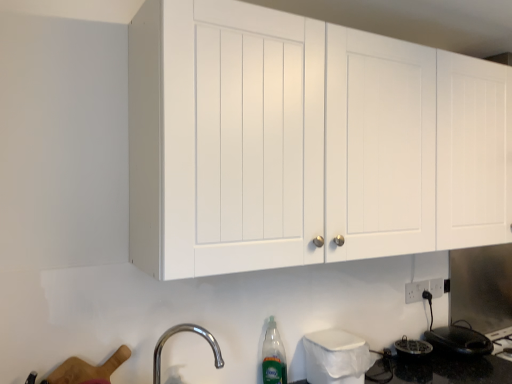
Find the location of a particular element. white plastic trash can at lower center, arranged as the second appliance when viewed from the right is located at coordinates (335, 357).

What do you see at coordinates (335, 357) in the screenshot? I see `white plastic trash can at lower center, placed as the 1th appliance when sorted from front to back` at bounding box center [335, 357].

Locate an element on the screen. translucent plastic bottle at lower center is located at coordinates (273, 356).

Locate an element on the screen. black glossy electric kettle at lower right, which appears as the first appliance when viewed from the right is located at coordinates (459, 340).

The height and width of the screenshot is (384, 512). What do you see at coordinates (184, 331) in the screenshot?
I see `chrome metallic faucet at lower left` at bounding box center [184, 331].

This screenshot has height=384, width=512. Identify the location of white plastic trash can at lower center, which is the 1th appliance in left-to-right order. (335, 357).

Looking at this image, does translucent plastic bottle at lower center come in front of chrome metallic faucet at lower left?

No, it is behind chrome metallic faucet at lower left.

Does translucent plastic bottle at lower center have a greater width compared to chrome metallic faucet at lower left?

In fact, translucent plastic bottle at lower center might be narrower than chrome metallic faucet at lower left.

Can you tell me how much translucent plastic bottle at lower center and chrome metallic faucet at lower left differ in facing direction?

They differ by 0.00493 degrees in their facing directions.

Is point (281, 345) farther from camera compared to point (222, 358)?

Yes, it is.

From a real-world perspective, is white matte cabinet at upper center beneath chrome metallic faucet at lower left?

No.

Where is `tap on the left of white matte cabinet at upper center`? This screenshot has height=384, width=512. tap on the left of white matte cabinet at upper center is located at coordinates (184, 331).

Could you tell me if white matte cabinet at upper center is facing chrome metallic faucet at lower left?

No, white matte cabinet at upper center is not turned towards chrome metallic faucet at lower left.

Is white matte cabinet at upper center not near chrome metallic faucet at lower left?

No, white matte cabinet at upper center is in close proximity to chrome metallic faucet at lower left.

From a real-world perspective, is translucent plastic bottle at lower center on top of white matte cabinet at upper center?

No, from a real-world perspective, translucent plastic bottle at lower center is not over white matte cabinet at upper center

In the scene shown: Can you confirm if translucent plastic bottle at lower center is wider than white matte cabinet at upper center?

In fact, translucent plastic bottle at lower center might be narrower than white matte cabinet at upper center.

Is translucent plastic bottle at lower center looking in the opposite direction of white matte cabinet at upper center?

translucent plastic bottle at lower center is not turned away from white matte cabinet at upper center.

Is white plastic trash can at lower center, placed as the 1th appliance when sorted from front to back, aimed at white matte cabinet at upper center?

No.

Is the position of white plastic trash can at lower center, the second appliance viewed from the back, more distant than that of white matte cabinet at upper center?

Yes, white plastic trash can at lower center, the second appliance viewed from the back, is further from the camera.

How many degrees apart are the facing directions of white plastic trash can at lower center, placed as the 1th appliance when sorted from front to back, and white matte cabinet at upper center?

0.00213 degrees.

Is the surface of white plastic trash can at lower center, arranged as the second appliance when viewed from the right, in direct contact with white matte cabinet at upper center?

No, white plastic trash can at lower center, arranged as the second appliance when viewed from the right, is not making contact with white matte cabinet at upper center.

Considering the sizes of black glossy electric kettle at lower right, arranged as the 2th appliance when viewed from the front, and translucent plastic bottle at lower center in the image, is black glossy electric kettle at lower right, arranged as the 2th appliance when viewed from the front, bigger or smaller than translucent plastic bottle at lower center?

black glossy electric kettle at lower right, arranged as the 2th appliance when viewed from the front, is bigger than translucent plastic bottle at lower center.

Is black glossy electric kettle at lower right, which ranks as the second appliance in left-to-right order, in front of or behind translucent plastic bottle at lower center in the image?

black glossy electric kettle at lower right, which ranks as the second appliance in left-to-right order, is behind translucent plastic bottle at lower center.

Is point (472, 354) closer or farther from the camera than point (270, 350)?

Point (472, 354).

Looking at their sizes, would you say white matte cabinet at upper center is wider or thinner than black glossy electric kettle at lower right, arranged as the 2th appliance when viewed from the front?

Clearly, white matte cabinet at upper center has more width compared to black glossy electric kettle at lower right, arranged as the 2th appliance when viewed from the front.

Locate an element on the screen. The image size is (512, 384). cabinetry above the black glossy electric kettle at lower right, which ranks as the first appliance in back-to-front order (from a real-world perspective) is located at coordinates (303, 141).

Between white matte cabinet at upper center and black glossy electric kettle at lower right, which ranks as the first appliance in back-to-front order, which one has smaller size?

With smaller size is black glossy electric kettle at lower right, which ranks as the first appliance in back-to-front order.

Is white plastic trash can at lower center, placed as the 1th appliance when sorted from front to back, oriented away from black glossy electric kettle at lower right, arranged as the 2th appliance when viewed from the front?

No, white plastic trash can at lower center, placed as the 1th appliance when sorted from front to back, is not facing away from black glossy electric kettle at lower right, arranged as the 2th appliance when viewed from the front.

Can you confirm if white plastic trash can at lower center, the second appliance viewed from the back, is shorter than black glossy electric kettle at lower right, which ranks as the first appliance in back-to-front order?

Incorrect, the height of white plastic trash can at lower center, the second appliance viewed from the back, does not fall short of that of black glossy electric kettle at lower right, which ranks as the first appliance in back-to-front order.

From the image's perspective, is white plastic trash can at lower center, which is the 1th appliance in left-to-right order, above or below black glossy electric kettle at lower right, which ranks as the second appliance in left-to-right order?

Clearly, from the image's perspective, white plastic trash can at lower center, which is the 1th appliance in left-to-right order, is above black glossy electric kettle at lower right, which ranks as the second appliance in left-to-right order.

Who is smaller, white plastic trash can at lower center, the second appliance viewed from the back, or black glossy electric kettle at lower right, arranged as the 2th appliance when viewed from the front?

black glossy electric kettle at lower right, arranged as the 2th appliance when viewed from the front, is smaller.

At what (x,y) coordinates should I click in order to perform the action: click on tap located in front of the translucent plastic bottle at lower center. Please return your answer as a coordinate pair (x, y). Looking at the image, I should click on (184, 331).

Identify the location of cabinetry lying above the chrome metallic faucet at lower left (from the image's perspective). This screenshot has width=512, height=384. (303, 141).

Looking at the image, which one is located further to white matte cabinet at upper center, chrome metallic faucet at lower left or translucent plastic bottle at lower center?

chrome metallic faucet at lower left is further to white matte cabinet at upper center.

Which object lies nearer to the anchor point black glossy electric kettle at lower right, arranged as the 2th appliance when viewed from the front, translucent plastic bottle at lower center or chrome metallic faucet at lower left?

translucent plastic bottle at lower center is closer to black glossy electric kettle at lower right, arranged as the 2th appliance when viewed from the front.

Consider the image. When comparing their distances from white matte cabinet at upper center, does black glossy electric kettle at lower right, which ranks as the first appliance in back-to-front order, or translucent plastic bottle at lower center seem further?

The object further to white matte cabinet at upper center is black glossy electric kettle at lower right, which ranks as the first appliance in back-to-front order.

From the image, which object appears to be farther from white matte cabinet at upper center, white plastic trash can at lower center, arranged as the second appliance when viewed from the right, or chrome metallic faucet at lower left?

Based on the image, chrome metallic faucet at lower left appears to be further to white matte cabinet at upper center.

In the scene shown: Looking at the image, which one is located closer to black glossy electric kettle at lower right, arranged as the 2th appliance when viewed from the front, translucent plastic bottle at lower center or white plastic trash can at lower center, placed as the 1th appliance when sorted from front to back?

white plastic trash can at lower center, placed as the 1th appliance when sorted from front to back.

Based on their spatial positions, is chrome metallic faucet at lower left or black glossy electric kettle at lower right, which ranks as the second appliance in left-to-right order, further from white plastic trash can at lower center, arranged as the second appliance when viewed from the right?

black glossy electric kettle at lower right, which ranks as the second appliance in left-to-right order, is positioned further to the anchor white plastic trash can at lower center, arranged as the second appliance when viewed from the right.

Which object lies further to the anchor point translucent plastic bottle at lower center, black glossy electric kettle at lower right, which ranks as the second appliance in left-to-right order, or white matte cabinet at upper center?

Among the two, black glossy electric kettle at lower right, which ranks as the second appliance in left-to-right order, is located further to translucent plastic bottle at lower center.

Looking at the image, which one is located closer to chrome metallic faucet at lower left, translucent plastic bottle at lower center or white matte cabinet at upper center?

translucent plastic bottle at lower center lies closer to chrome metallic faucet at lower left than the other object.

Locate an element on the screen. The image size is (512, 384). bottle between chrome metallic faucet at lower left and white plastic trash can at lower center, arranged as the second appliance when viewed from the right is located at coordinates (273, 356).

Where is `bottle between white matte cabinet at upper center and black glossy electric kettle at lower right, which ranks as the first appliance in back-to-front order, vertically`? The height and width of the screenshot is (384, 512). bottle between white matte cabinet at upper center and black glossy electric kettle at lower right, which ranks as the first appliance in back-to-front order, vertically is located at coordinates (273, 356).

The width and height of the screenshot is (512, 384). Find the location of `bottle between white matte cabinet at upper center and white plastic trash can at lower center, arranged as the second appliance when viewed from the right, vertically`. bottle between white matte cabinet at upper center and white plastic trash can at lower center, arranged as the second appliance when viewed from the right, vertically is located at coordinates (273, 356).

Locate an element on the screen. tap that lies between white matte cabinet at upper center and translucent plastic bottle at lower center from top to bottom is located at coordinates (184, 331).